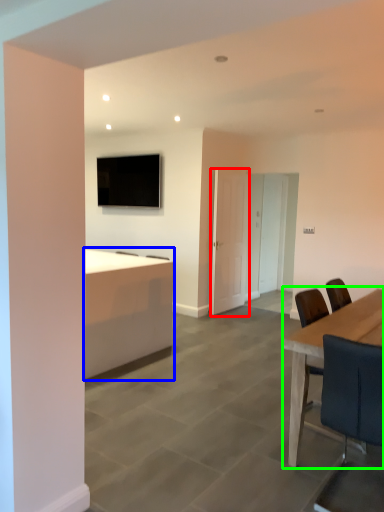
Question: Which object is positioned farthest from door (highlighted by a red box)? Select from desk (highlighted by a blue box) and table (highlighted by a green box).

Choices:
 (A) desk
 (B) table

Answer: (B)